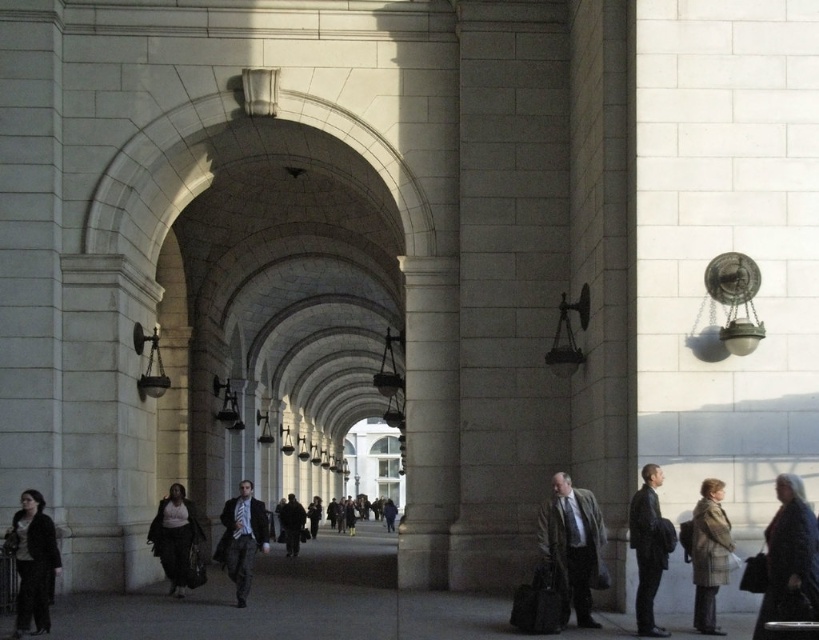
Question: Does dark gray textured coat at right appear on the left side of dark gray suit at center?

Choices:
 (A) no
 (B) yes

Answer: (A)

Question: Where is matte black suit at center located in relation to dark brown leather coat at center in the image?

Choices:
 (A) below
 (B) above

Answer: (B)

Question: Which of the following is the farthest from the observer?

Choices:
 (A) gray wool coat at center
 (B) dark brown leather coat at center
 (C) dark gray textured coat at right

Answer: (B)

Question: Which of the following is the farthest from the observer?

Choices:
 (A) (35, 593)
 (B) (571, 588)
 (C) (793, 604)
 (D) (313, 502)

Answer: (D)

Question: Considering the relative positions of dark gray jacket at lower left and plaid wool coat at lower right in the image provided, where is dark gray jacket at lower left located with respect to plaid wool coat at lower right?

Choices:
 (A) above
 (B) below

Answer: (B)

Question: Considering the real-world distances, which object is closest to the dark gray suit at right?

Choices:
 (A) dark gray jacket at lower left
 (B) dark brown leather coat at center
 (C) plaid wool coat at lower right
 (D) matte black suit at center

Answer: (C)